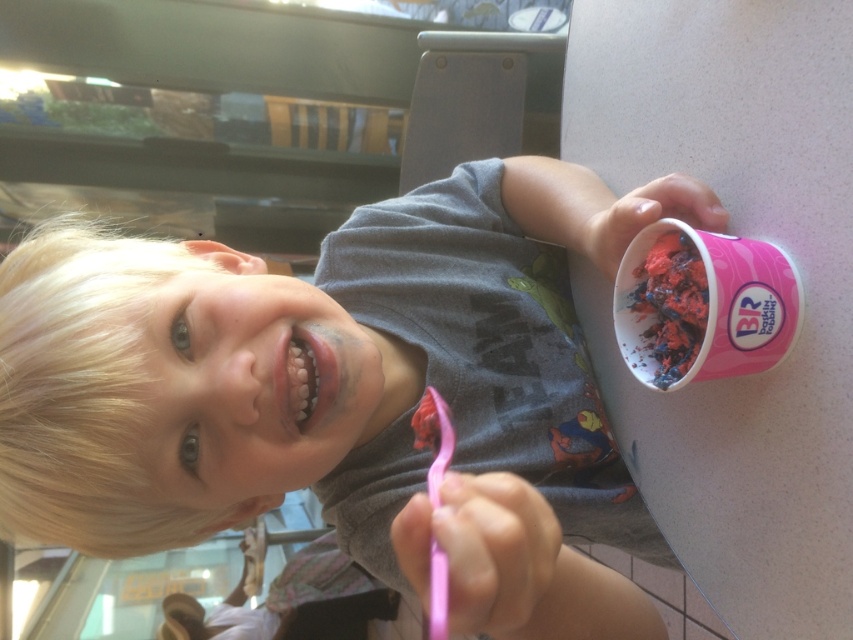
You are a parent who wants to pack the pink matte ice cream cup at right and the pink plastic toothbrush at lower center into a lunchbox that can only hold items up to 15 cm in height. Which item might not fit and why?

The pink matte ice cream cup at right is much taller than the pink plastic toothbrush at lower center. Since the ice cream cup is taller, it might not fit into the lunchbox with a 15 cm height limit.

You are a delivery person who needs to place a small package between the point at coordinates point [265,403] and the child. The package requires 18 inches of space. Will there be enough space?

The distance between the point at coordinates point [265,403] and the child is 20.16 inches, which is more than the required 18 inches. Therefore, there is enough space to place the package.

You are a customer in a restaurant and want to order an ice cream. The server points to a specific location in the menu. The menu has a coordinate system where the top left corner is the origin. The server says the ice cream you want is at point (345, 394). Where is the ice cream located on the menu?

The ice cream is located at point (345, 394) on the menu, which corresponds to the pink matte ice cream cup at right.